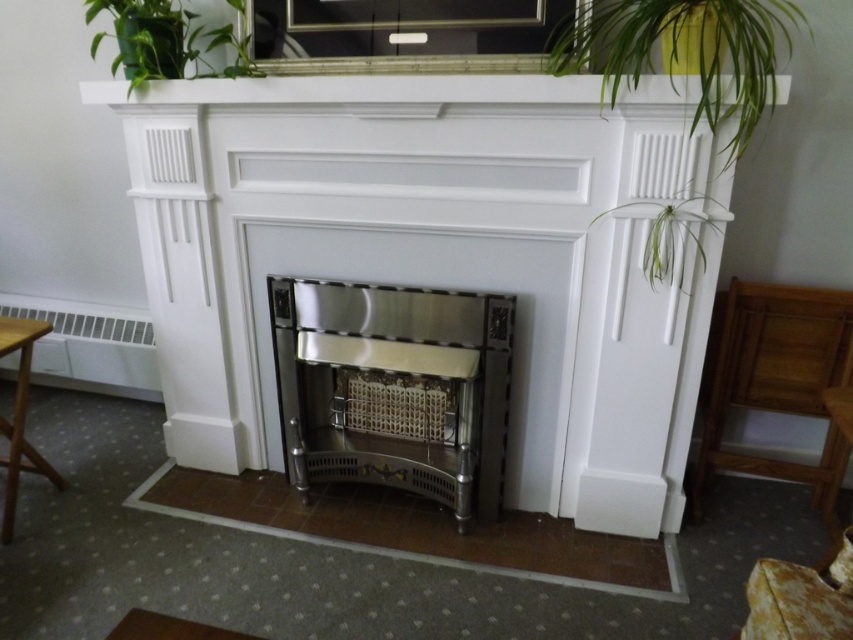
You are planning to place a new sofa in the living room. The sofa you want is the same size as the leather textured armchair at lower right. Will the stainless steel fireplace at center fit in the space where the sofa will be placed?

The stainless steel fireplace at center is bigger than the leather textured armchair at lower right. Since the sofa is the same size as the armchair, the fireplace would not fit in that space because it is larger.

Consider the image. You are standing in front of the fireplace mantel and want to place a small decoration between the two points labeled point (405, 330) and point (801, 577). Which point should you place the decoration closer to so that it appears closer to you?

You should place the decoration closer to point (405, 330) because it is closer to you than point (801, 577).

You are arranging a small decorative item that is 10 cm wide. You want to place it on the mantel between the green leafy plant at upper right and the leather textured armchair at lower right. Is there enough space?

The green leafy plant at upper right is bigger than the leather textured armchair at lower right, but the exact distance between them isn not specified. Without knowing the space between the two objects, it is impossible to determine if the 10 cm decorative item will fit.